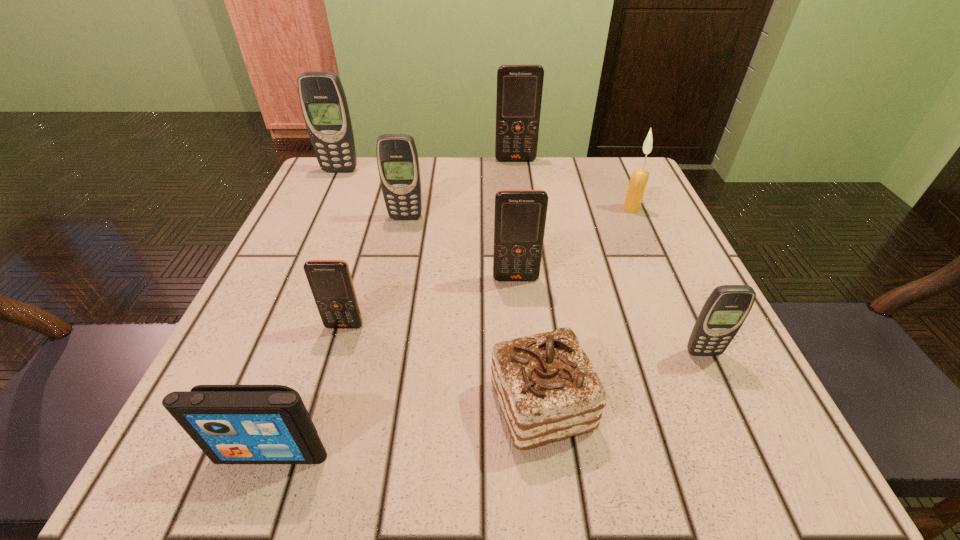
The image size is (960, 540). Identify the location of the farthest cellular telephone. (519, 86).

Image resolution: width=960 pixels, height=540 pixels. I want to click on the farthest object, so click(519, 86).

Find the location of a particular element. This screenshot has height=540, width=960. the second farthest object is located at coordinates (323, 101).

At what (x,y) coordinates should I click in order to perform the action: click on the leftmost gray cellular telephone. Please return your answer as a coordinate pair (x, y). The image size is (960, 540). Looking at the image, I should click on (323, 101).

In order to click on the second smallest gray cellular telephone in this screenshot , I will do 397,158.

You are a GUI agent. You are given a task and a screenshot of the screen. Output one action in this format:
    pyautogui.click(x=<x>, y=<y>)
    Task: Click on the second gray cellular telephone from right to left
    
    Given the screenshot: What is the action you would take?
    pyautogui.click(x=397, y=158)

Where is `the fifth nearest object`? the fifth nearest object is located at coordinates (520, 215).

The height and width of the screenshot is (540, 960). I want to click on the third nearest cellular telephone, so click(x=520, y=215).

The width and height of the screenshot is (960, 540). I want to click on candle, so click(639, 177).

Find the location of `cream candle`. cream candle is located at coordinates (639, 177).